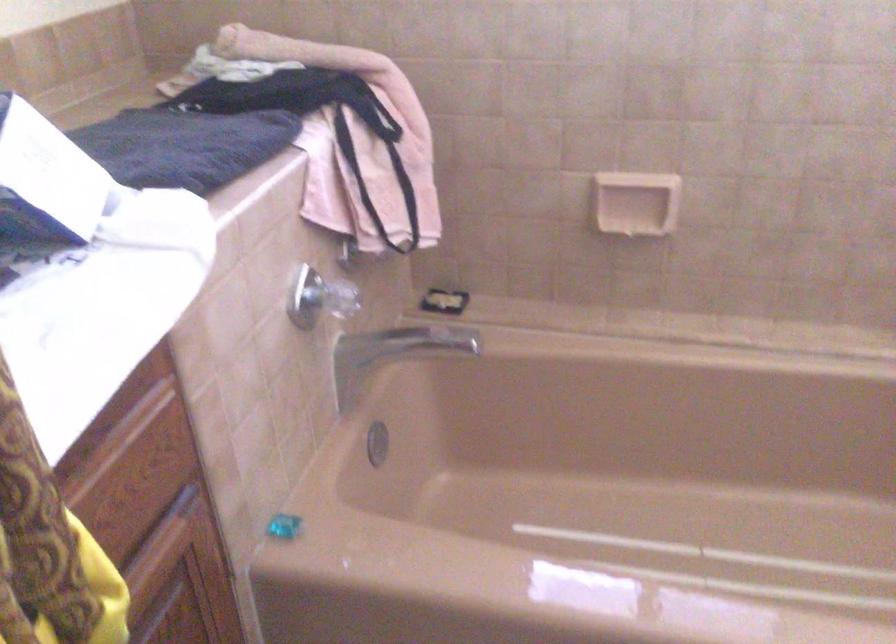
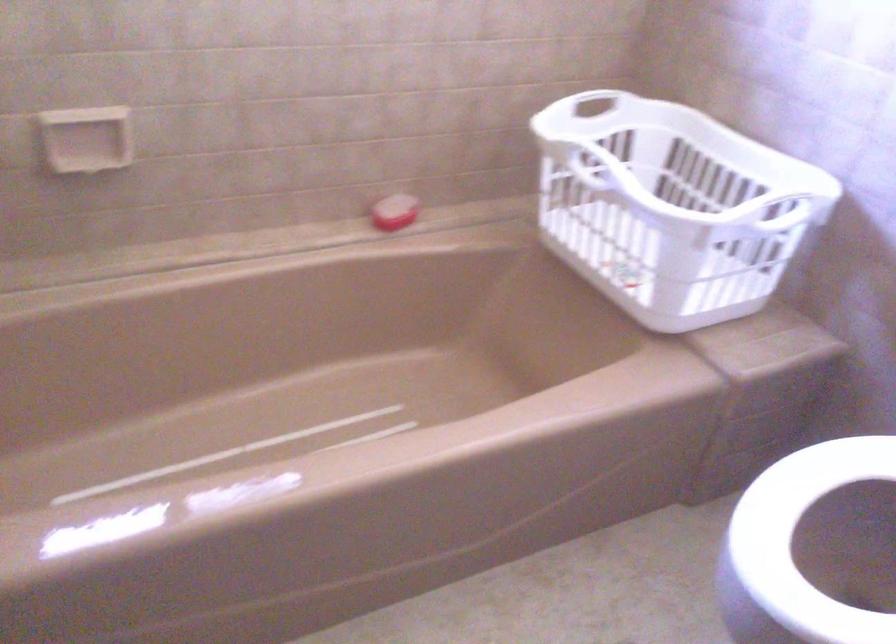
Question: Based on the continuous images, in which direction is the camera rotating? Reply with the corresponding letter.

Choices:
 (A) Left
 (B) Right
 (C) Up
 (D) Down

Answer: (B)